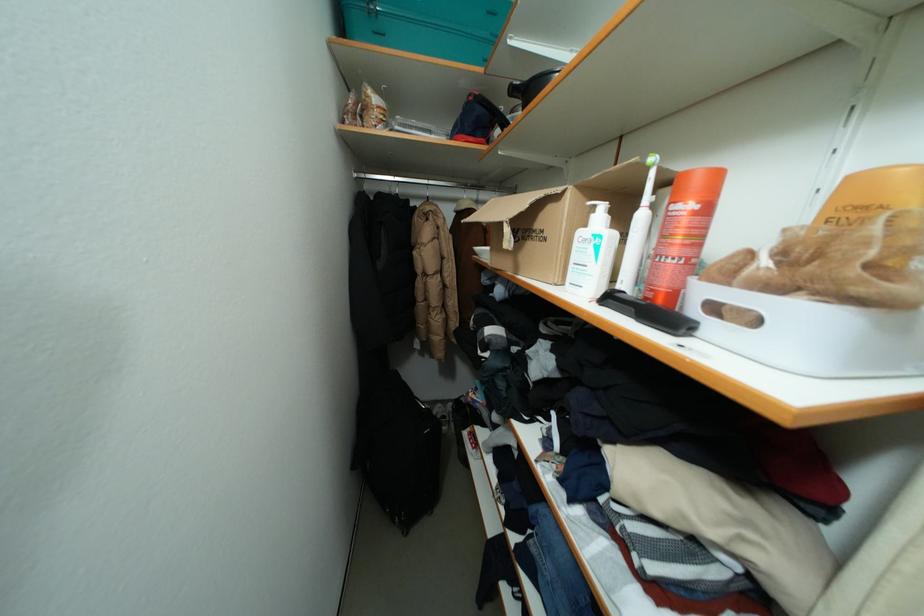
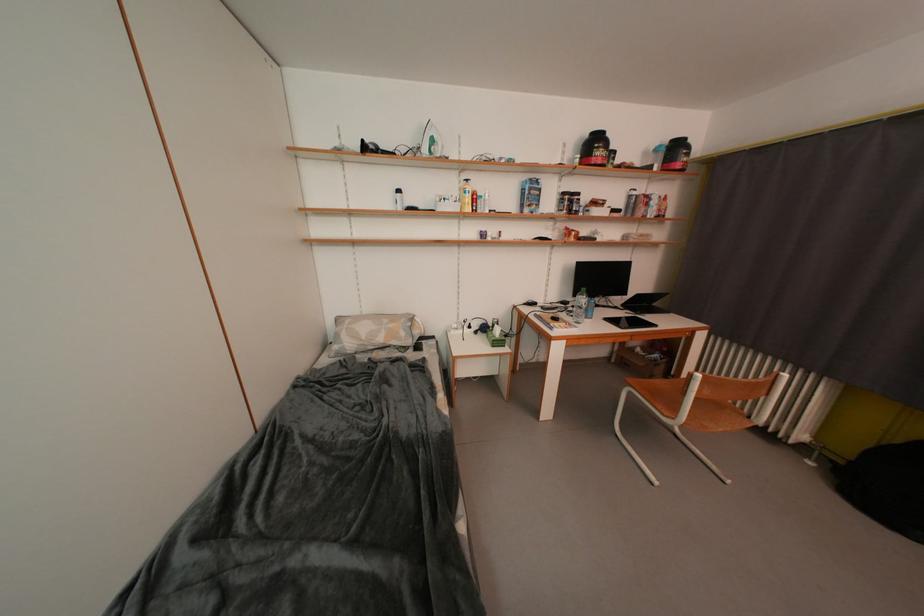
Question: Which direction would the cameraman need to move to produce the second image? Reply with the corresponding letter.

Choices:
 (A) Left
 (B) Right
 (C) Forward
 (D) Backward

Answer: (B)